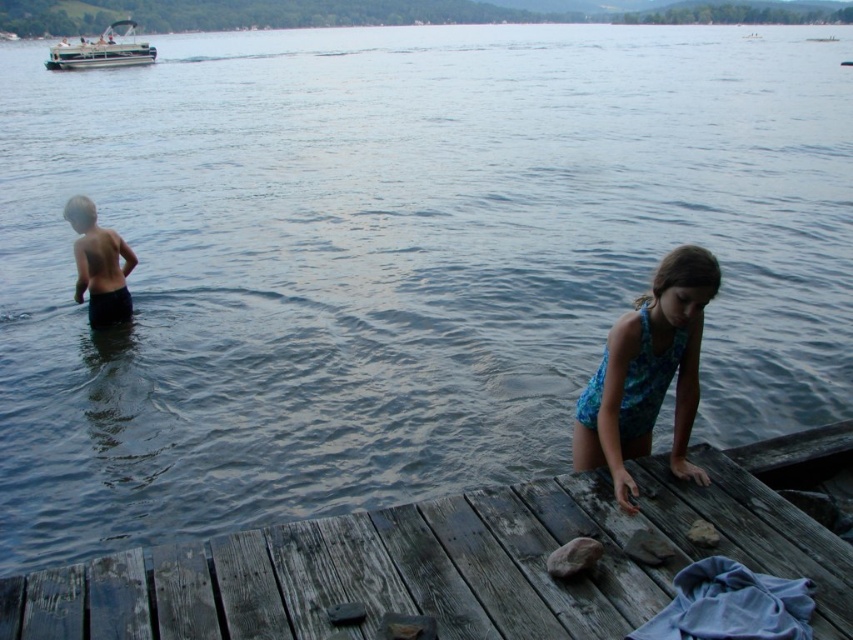
You are a lifeguard on duty at the lakeside. You notice a child playing near the water and spot the dark blue shorts at left. Where exactly are the dark blue shorts located in relation to the dock?

The dark blue shorts at left are located at point (x=99, y=264).

Looking at this image, you are standing on the dock and looking at two points marked on the wooden planks. Which point is closer to you, point (822, 433) or point (582, 433)?

Point (822, 433) is closer to you because it is further to the viewer than point (582, 433).